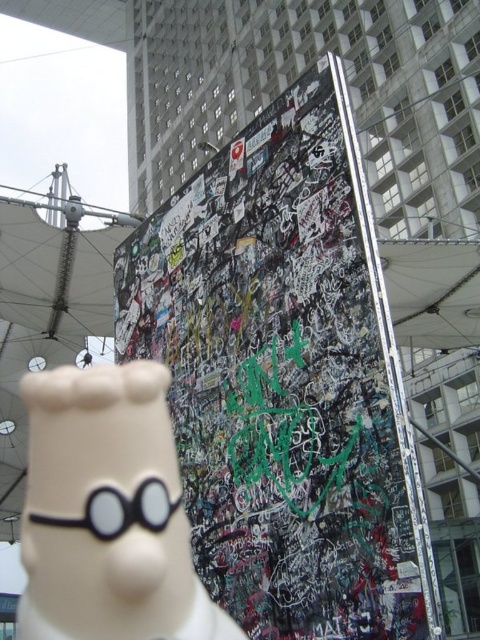
Find the location of a particular element. Image resolution: width=480 pixels, height=640 pixels. white matte figurine at center is located at coordinates (108, 513).

What are the coordinates of `white matte figurine at center` in the screenshot? It's located at (108, 513).